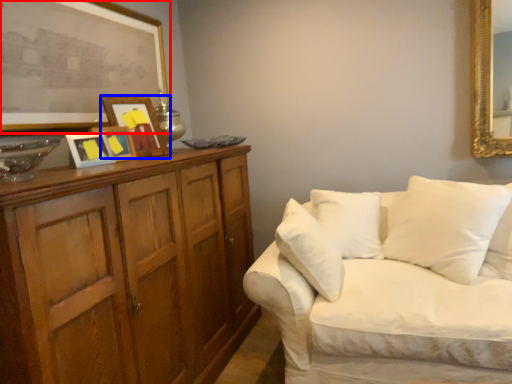
Question: Which point is further to the camera, picture frame (highlighted by a red box) or picture frame (highlighted by a blue box)?

Choices:
 (A) picture frame
 (B) picture frame

Answer: (B)